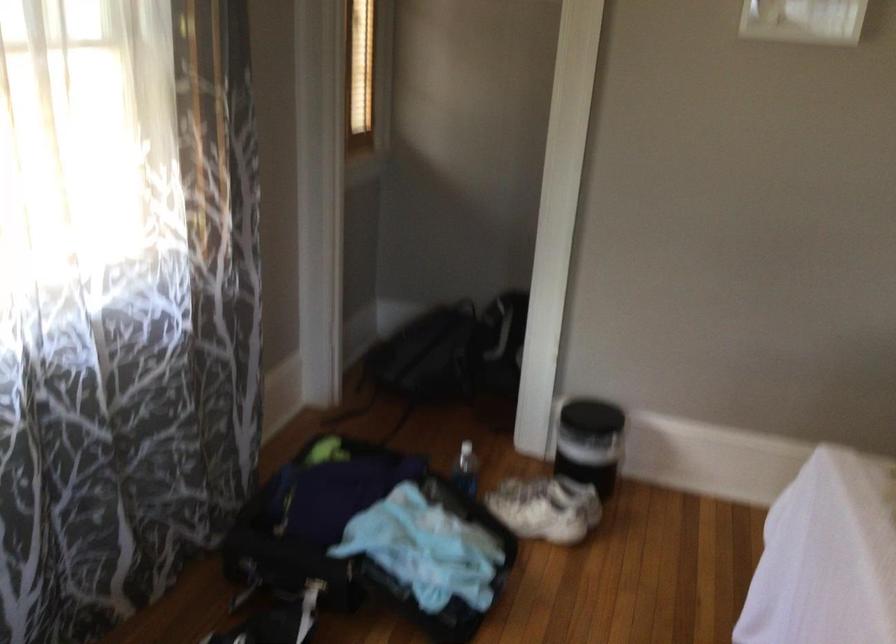
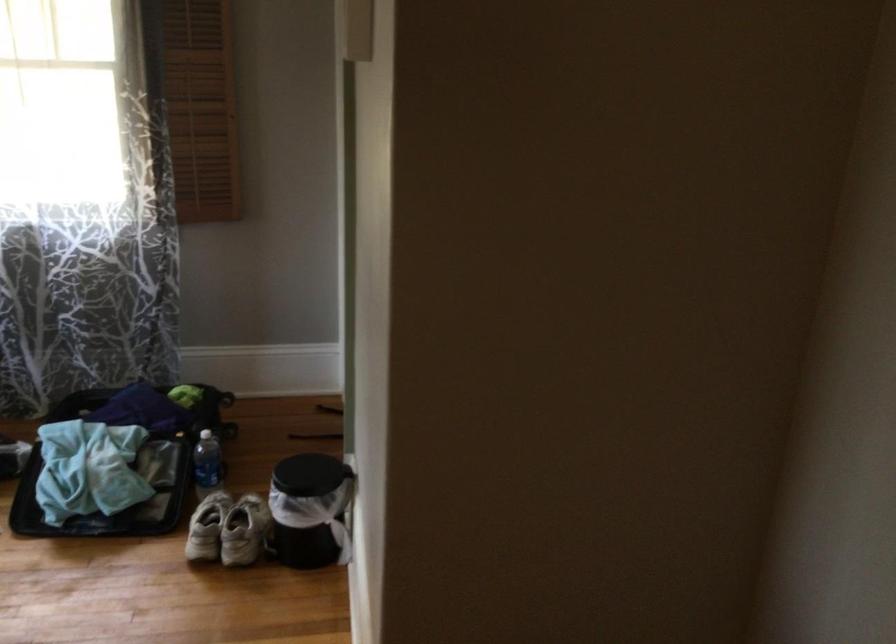
In the second image, find the point that corresponds to [578,502] in the first image.

(207, 527)